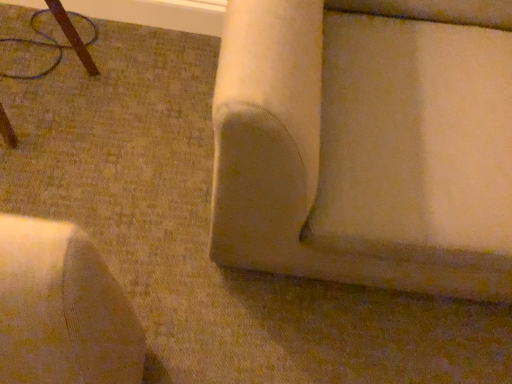
Question: Is brown wood table at upper left, the 2th furniture positioned from the right, aimed at beige fabric couch at center, acting as the 2th furniture starting from the left?

Choices:
 (A) no
 (B) yes

Answer: (B)

Question: Is the position of brown wood table at upper left, arranged as the first furniture when viewed from the left, less distant than that of beige fabric couch at center, which is the first furniture from right to left?

Choices:
 (A) yes
 (B) no

Answer: (B)

Question: Is brown wood table at upper left, the 2th furniture positioned from the right, taller than beige fabric couch at center, which is the first furniture from right to left?

Choices:
 (A) no
 (B) yes

Answer: (A)

Question: Considering the relative sizes of brown wood table at upper left, arranged as the first furniture when viewed from the left, and beige fabric couch at center, which is the first furniture from right to left, in the image provided, is brown wood table at upper left, arranged as the first furniture when viewed from the left, thinner than beige fabric couch at center, which is the first furniture from right to left,?

Choices:
 (A) yes
 (B) no

Answer: (A)

Question: Can you confirm if brown wood table at upper left, arranged as the first furniture when viewed from the left, is wider than beige fabric couch at center, which is the first furniture from right to left?

Choices:
 (A) no
 (B) yes

Answer: (A)

Question: Is brown wood table at upper left, arranged as the first furniture when viewed from the left, outside of beige fabric couch at center, which is the first furniture from right to left?

Choices:
 (A) yes
 (B) no

Answer: (A)

Question: Would you say beige fabric couch at center, which is the first furniture from right to left, is outside brown wood table at upper left, the 2th furniture positioned from the right?

Choices:
 (A) yes
 (B) no

Answer: (A)

Question: Is beige fabric couch at center, which is the first furniture from right to left, behind brown wood table at upper left, the 2th furniture positioned from the right?

Choices:
 (A) yes
 (B) no

Answer: (B)

Question: From a real-world perspective, is beige fabric couch at center, which is the first furniture from right to left, positioned over brown wood table at upper left, arranged as the first furniture when viewed from the left, based on gravity?

Choices:
 (A) yes
 (B) no

Answer: (A)

Question: Considering the relative sizes of beige fabric couch at center, which is the first furniture from right to left, and brown wood table at upper left, arranged as the first furniture when viewed from the left, in the image provided, is beige fabric couch at center, which is the first furniture from right to left, thinner than brown wood table at upper left, arranged as the first furniture when viewed from the left,?

Choices:
 (A) yes
 (B) no

Answer: (B)

Question: From the image's perspective, does beige fabric couch at center, acting as the 2th furniture starting from the left, appear higher than brown wood table at upper left, arranged as the first furniture when viewed from the left?

Choices:
 (A) no
 (B) yes

Answer: (A)

Question: Considering the relative sizes of beige fabric couch at center, which is the first furniture from right to left, and brown wood table at upper left, the 2th furniture positioned from the right, in the image provided, is beige fabric couch at center, which is the first furniture from right to left, smaller than brown wood table at upper left, the 2th furniture positioned from the right,?

Choices:
 (A) yes
 (B) no

Answer: (B)

Question: Is brown wood table at upper left, arranged as the first furniture when viewed from the left, to the left or to the right of beige fabric couch at center, which is the first furniture from right to left, in the image?

Choices:
 (A) right
 (B) left

Answer: (B)